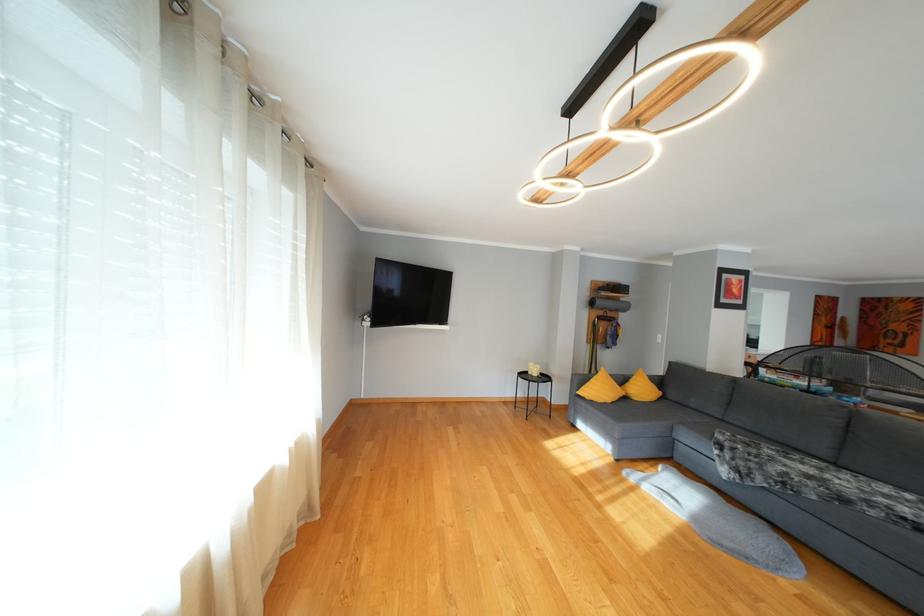
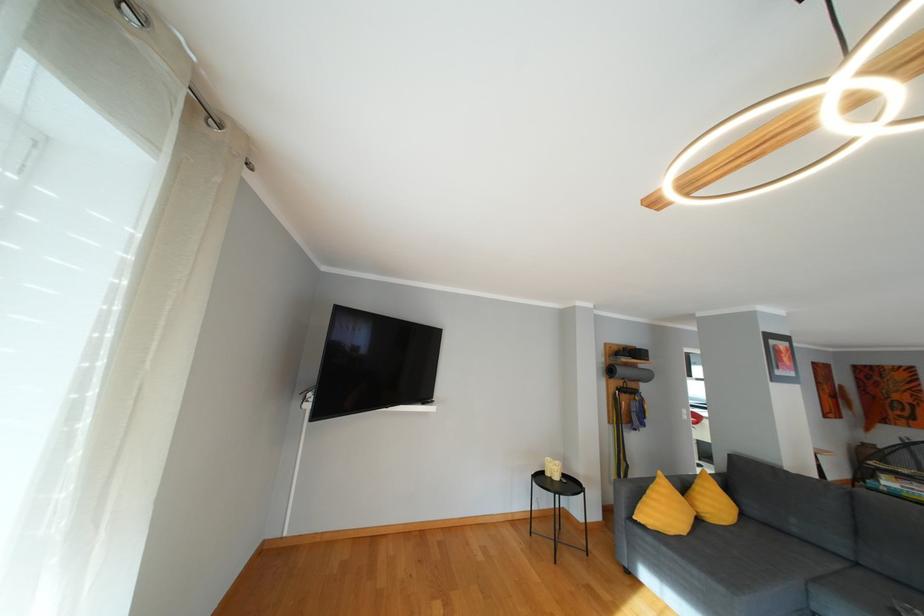
Question: The first image is from the beginning of the video and the second image is from the end. How did the camera likely rotate when shooting the video?

Choices:
 (A) Left
 (B) Right
 (C) Up
 (D) Down

Answer: (C)